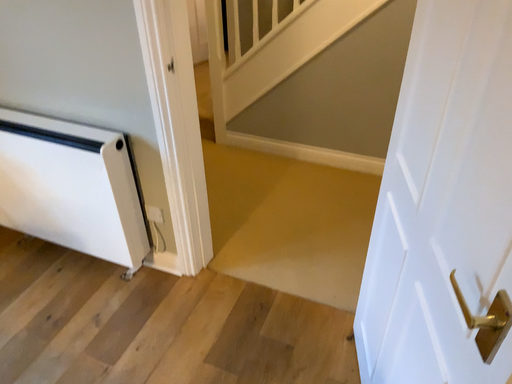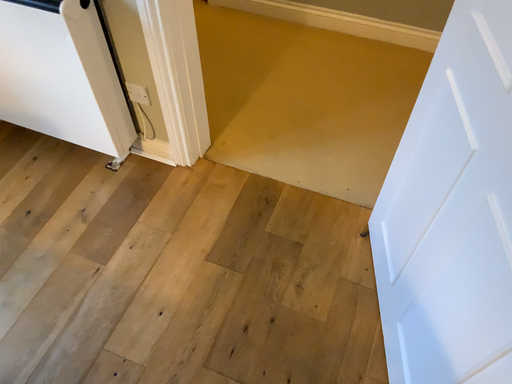
Question: Which way did the camera rotate in the video?

Choices:
 (A) rotated downward
 (B) rotated upward

Answer: (A)